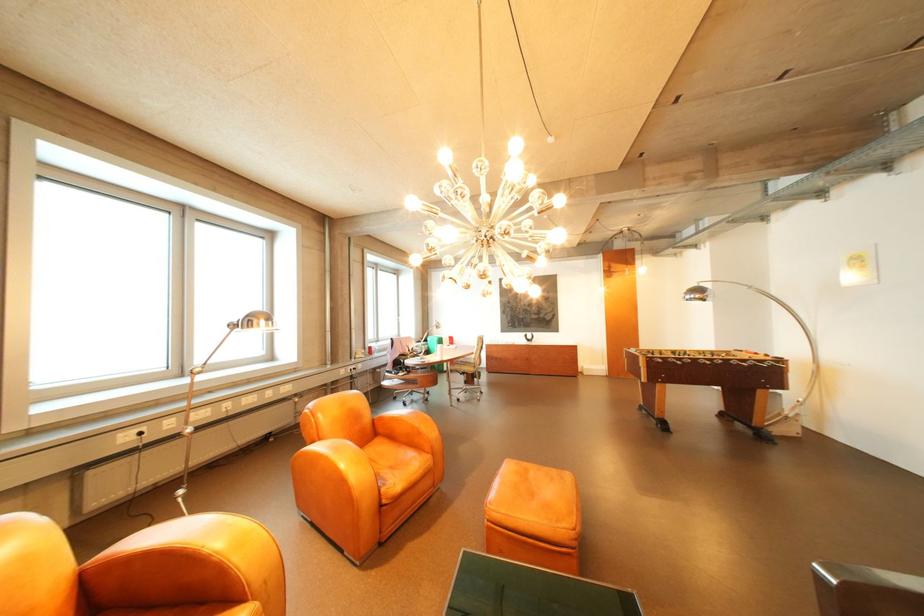
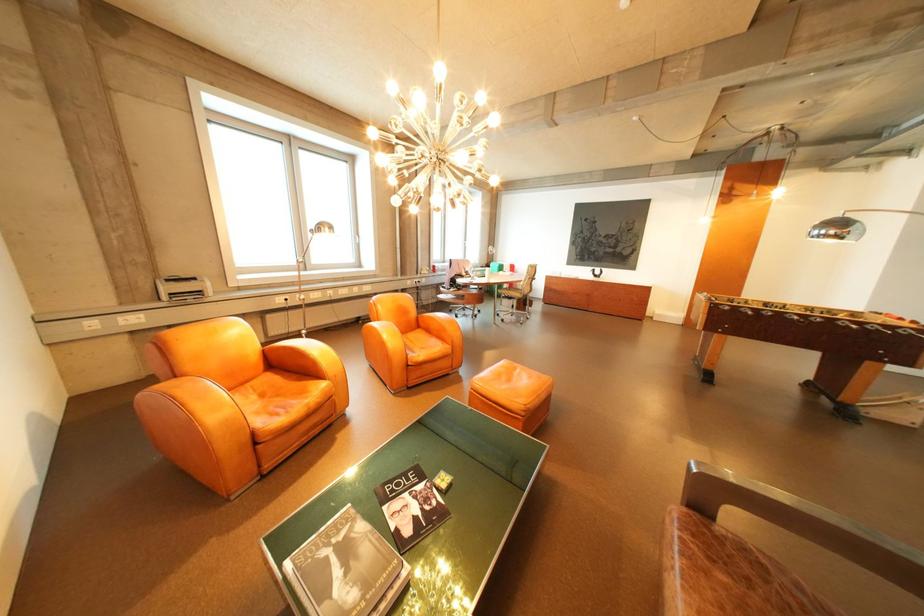
Where in the second image is the point corresponding to pixel 674 361 from the first image?

(740, 309)